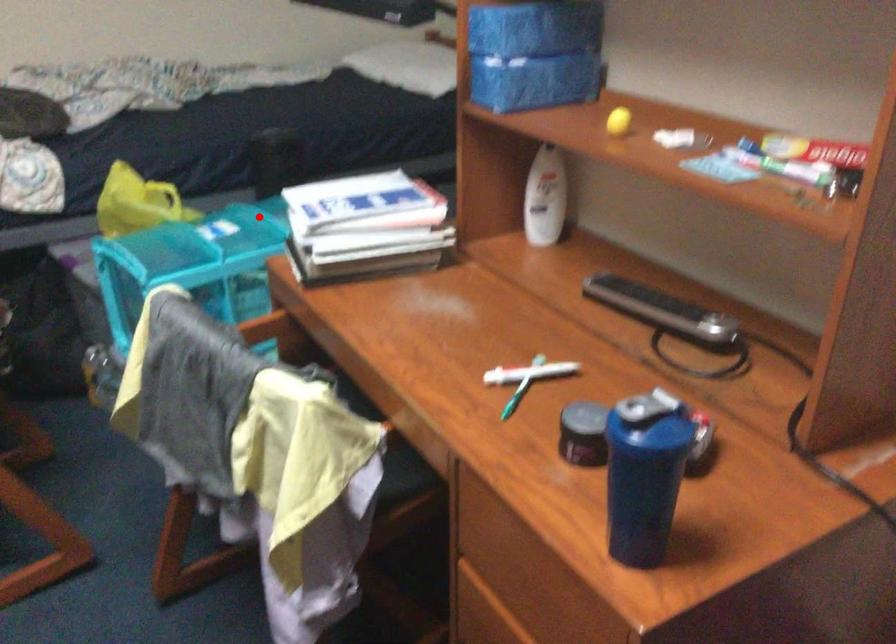
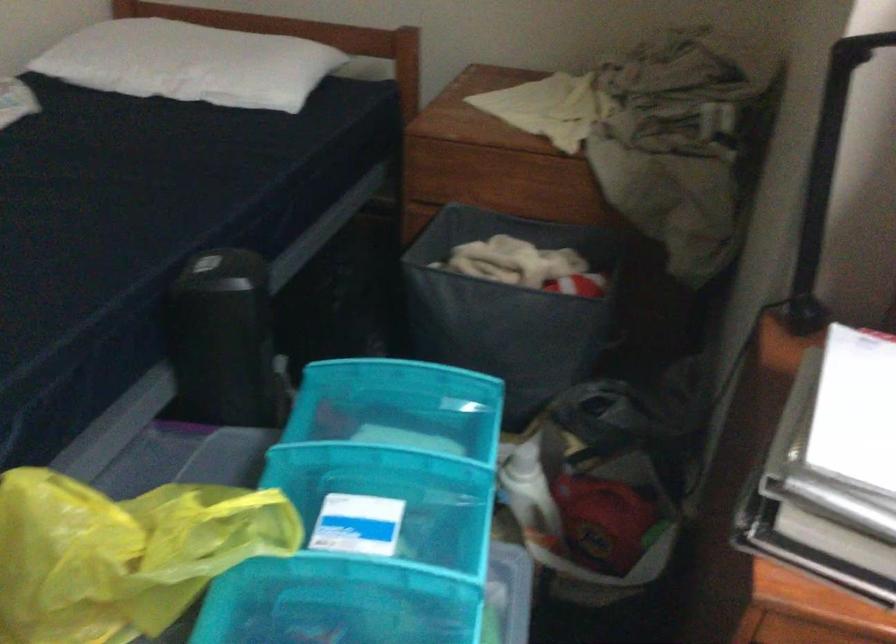
Question: I am providing you with two images of the same scene from different viewpoints. A red point is shown in image1. For the corresponding object point in image2, is it positioned nearer or farther from the camera?

Choices:
 (A) Nearer
 (B) Farther

Answer: (A)